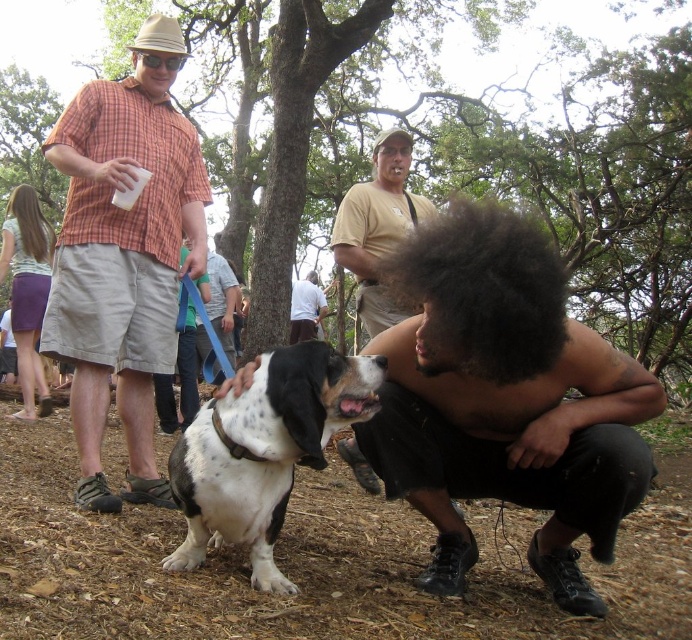
Who is shorter, plaid shirt at left or tan cotton shirt at center?

Standing shorter between the two is tan cotton shirt at center.

Between point (138, 218) and point (361, 320), which one is positioned in front?

Point (138, 218)

Is point (84, 225) in front of point (367, 225)?

Yes, point (84, 225) is in front of point (367, 225).

You are a GUI agent. You are given a task and a screenshot of the screen. Output one action in this format:
    pyautogui.click(x=<x>, y=<y>)
    Task: Click on the plaid shirt at left
    The image size is (692, 640).
    Given the screenshot: What is the action you would take?
    pyautogui.click(x=122, y=256)

Is shiny black hair at center taller than black curly hair at center?

Indeed, shiny black hair at center has a greater height compared to black curly hair at center.

Does point (459, 484) come in front of point (309, 273)?

Yes, point (459, 484) is in front of point (309, 273).

Describe the element at coordinates (504, 401) in the screenshot. I see `shiny black hair at center` at that location.

Locate an element on the screen. This screenshot has height=640, width=692. shiny black hair at center is located at coordinates (504, 401).

Who is shorter, white-spotted fur dog at center or tan cotton shirt at center?

white-spotted fur dog at center is shorter.

Which is behind, point (245, 467) or point (373, 150)?

Positioned behind is point (373, 150).

Is point (264, 465) farther from viewer compared to point (376, 237)?

That is False.

Where is `white-spotted fur dog at center`? white-spotted fur dog at center is located at coordinates (264, 451).